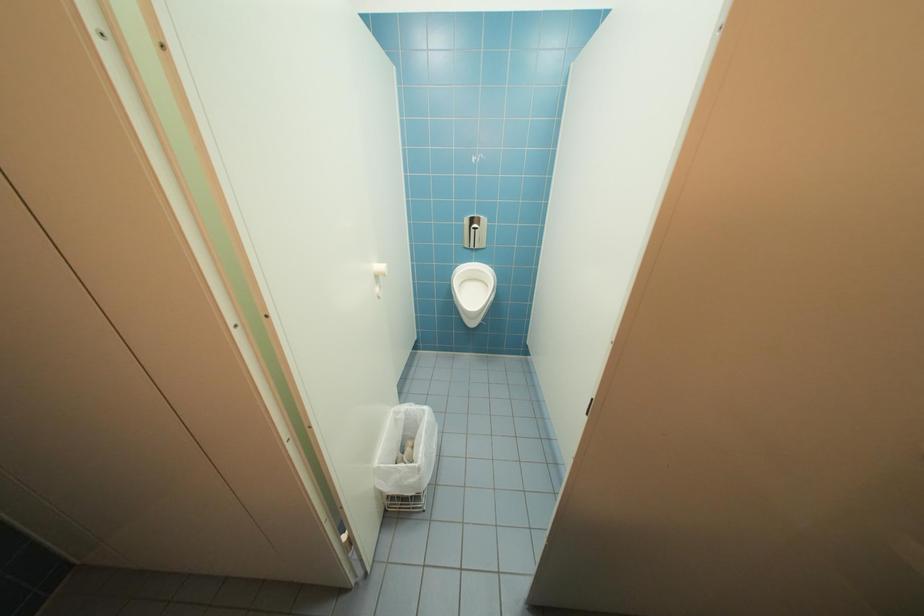
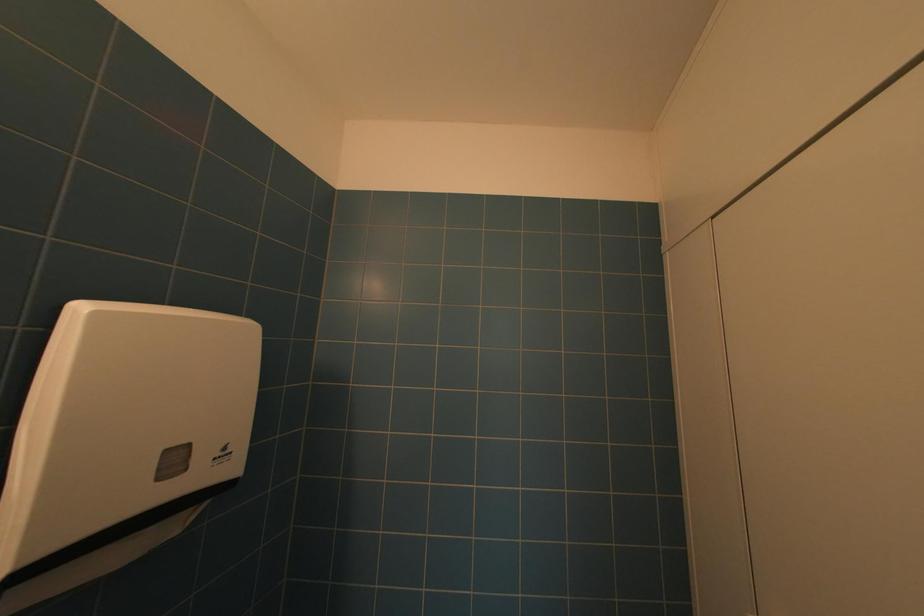
Question: The camera is either moving clockwise (left) or counter-clockwise (right) around the object. The first image is from the beginning of the video and the second image is from the end. Is the camera moving left or right when shooting the video?

Choices:
 (A) Left
 (B) Right

Answer: (B)